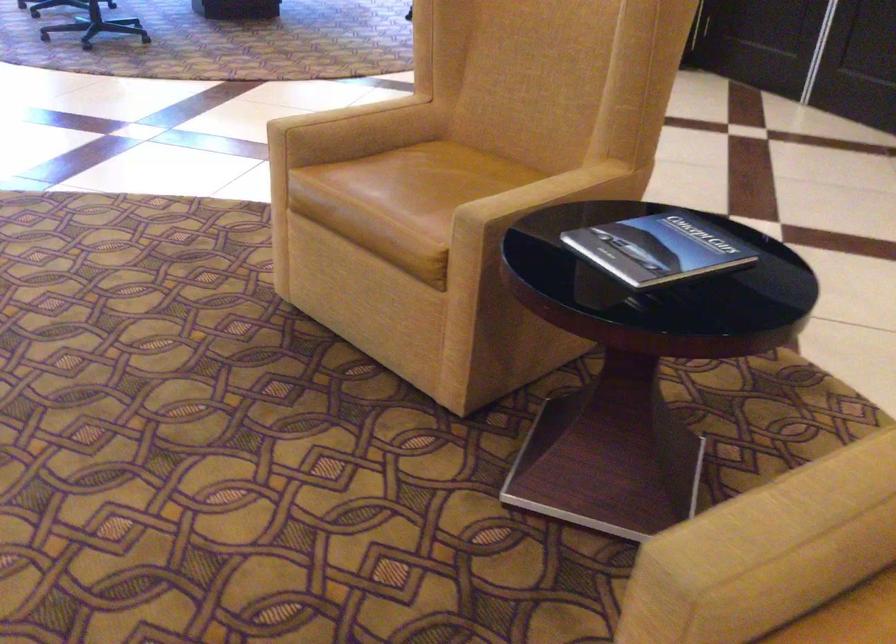
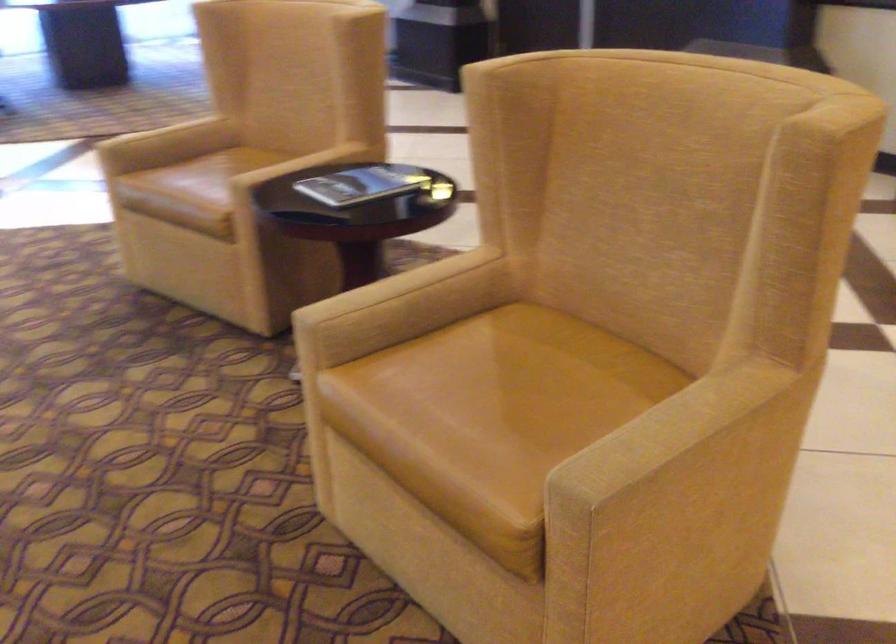
In the second image, find the point that corresponds to (x=782, y=480) in the first image.

(394, 286)